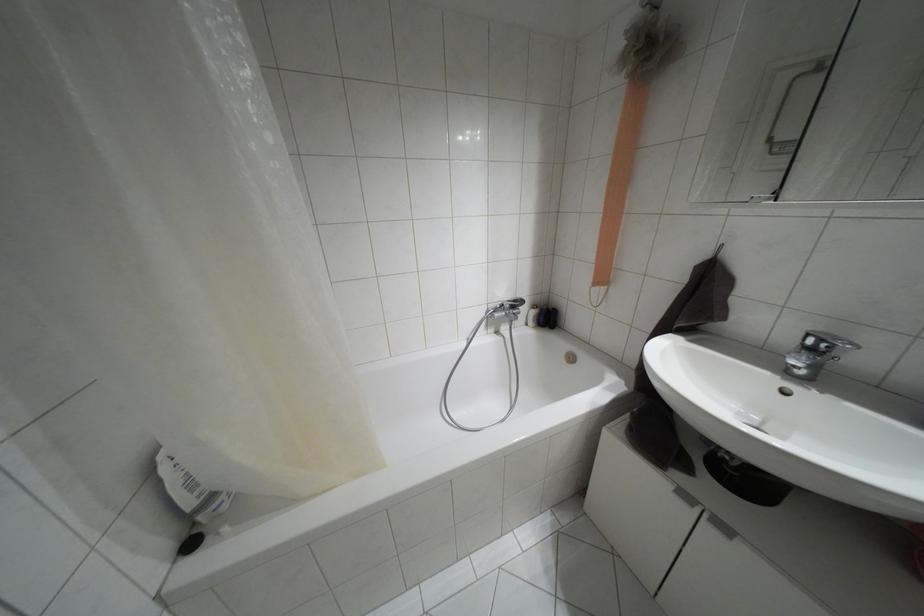
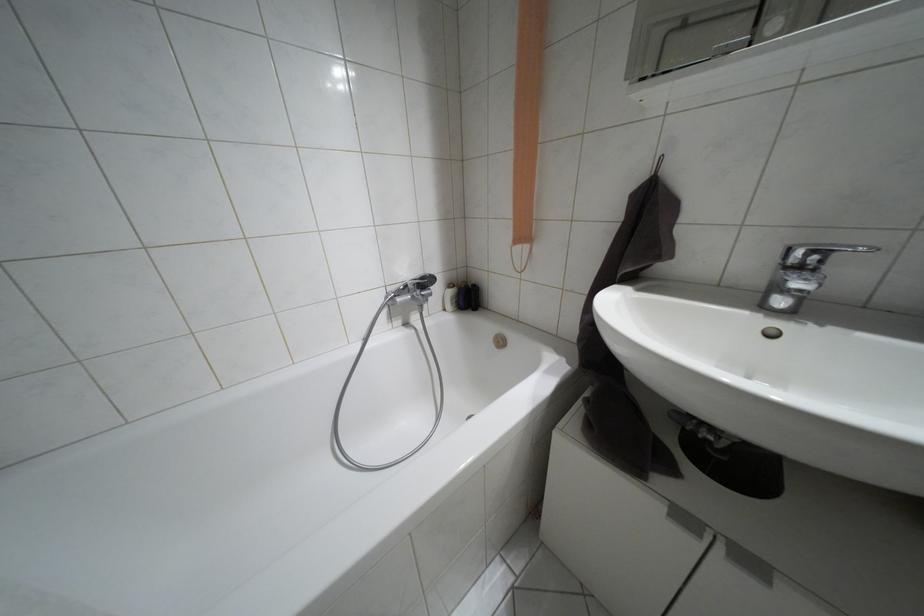
Question: Based on the continuous images, in which direction is the camera rotating? Reply with the corresponding letter.

Choices:
 (A) Left
 (B) Right
 (C) Up
 (D) Down

Answer: (B)